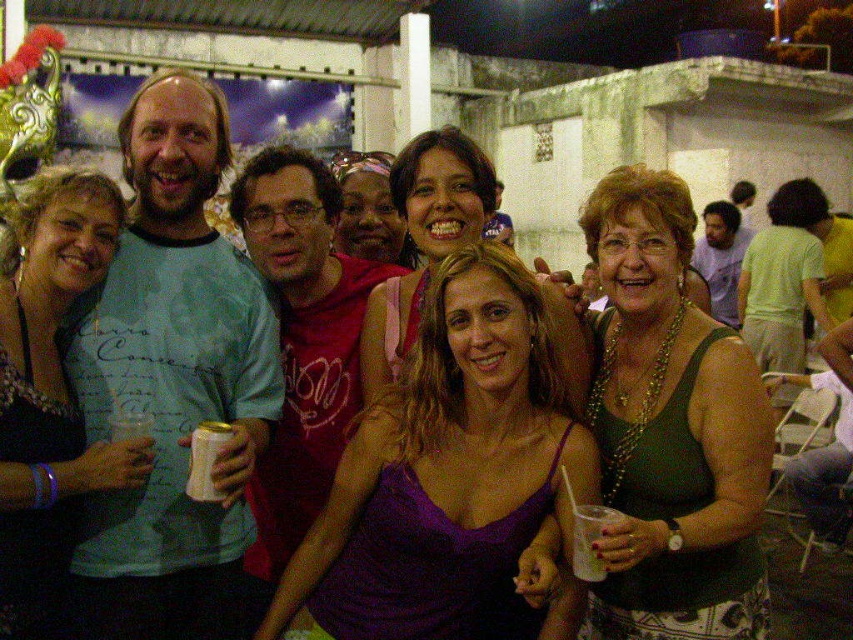
In the image of the social event, there is a purple satin tank top at center and other clothing items. Which clothing item is located exactly at the coordinates point [424,241]?

The purple satin tank top at center is located exactly at the coordinates point [424,241].

Consider the image. You are a photographer at the event and want to ensure both the matte black dress at center and the purple satin tank top at center are visible in the photo. Based on their positions, which one is lower in the frame?

The matte black dress at center is below the purple satin tank top at center, so the matte black dress at center is lower in the frame.

Consider the image. You are taking a photo of the group at the social event. You want to focus on the person at point [20,452] and the person at point [291,410]. Which person is closer to the camera?

The person at point [20,452] is closer to the camera than the person at point [291,410].